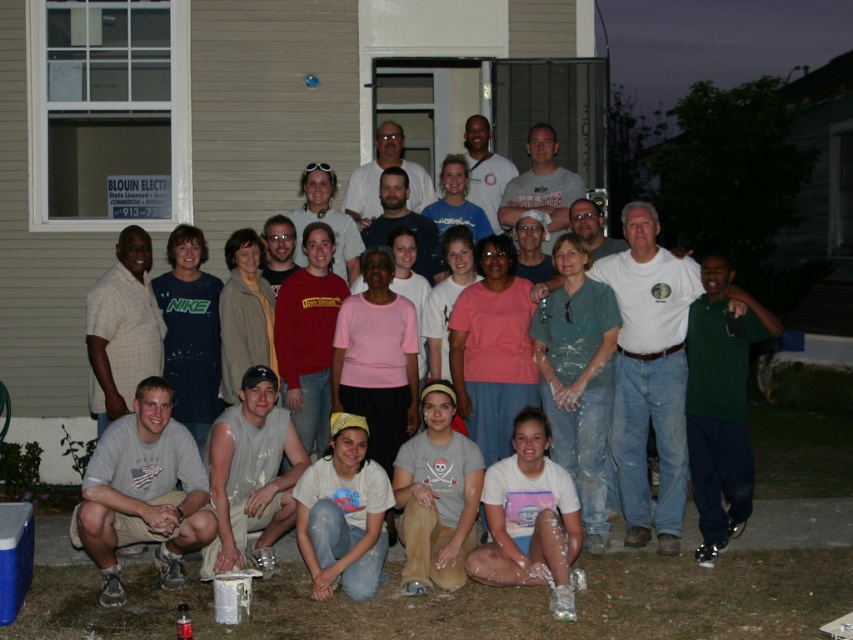
In the scene shown: Does white matte t-shirts at center have a lesser width compared to matte white shirt at center?

No, white matte t-shirts at center is not thinner than matte white shirt at center.

Measure the distance between white matte t-shirts at center and camera.

9.00 meters

What do you see at coordinates (219, 323) in the screenshot?
I see `white matte t-shirts at center` at bounding box center [219, 323].

Find the location of a particular element. The image size is (853, 640). white matte t-shirts at center is located at coordinates (219, 323).

Is point (512, 456) positioned after point (366, 211)?

No.

Can you confirm if white cotton shirt at lower center is positioned to the right of matte white shirt at center?

Correct, you'll find white cotton shirt at lower center to the right of matte white shirt at center.

Does point (560, 552) come behind point (358, 186)?

That is False.

This screenshot has width=853, height=640. What are the coordinates of `white cotton shirt at lower center` in the screenshot? It's located at (531, 518).

How much distance is there between white cotton shirt at center and gray cotton t-shirt at lower left?

white cotton shirt at center and gray cotton t-shirt at lower left are 12.31 feet apart from each other.

Does white cotton shirt at center have a greater height compared to gray cotton t-shirt at lower left?

Correct, white cotton shirt at center is much taller as gray cotton t-shirt at lower left.

Find the location of a particular element. The image size is (853, 640). white cotton shirt at center is located at coordinates (648, 374).